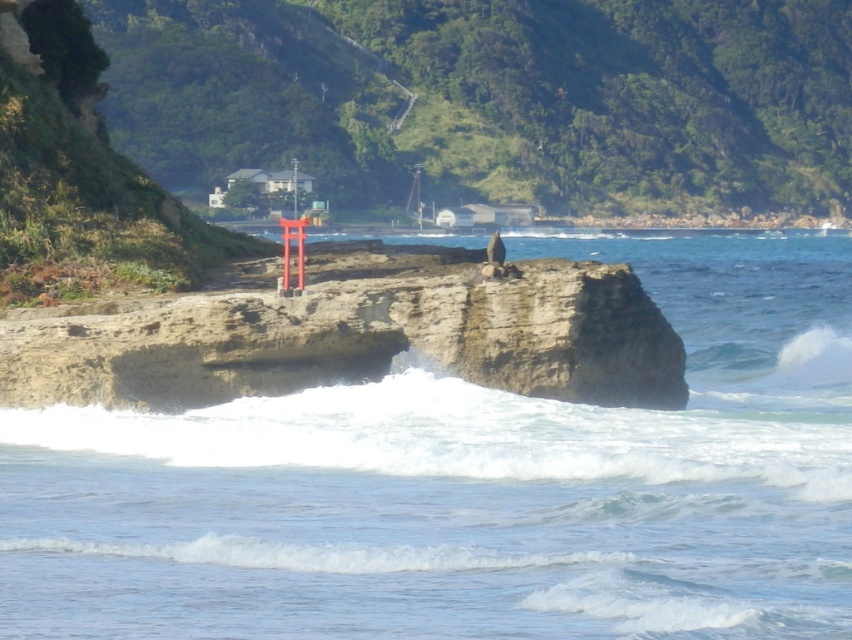
Question: Does clear blue water at center have a greater width compared to rusty stone cliff at center?

Choices:
 (A) yes
 (B) no

Answer: (A)

Question: Among these objects, which one is nearest to the camera?

Choices:
 (A) rusty stone cliff at center
 (B) clear blue water at center

Answer: (B)

Question: Is clear blue water at center to the right of rusty stone cliff at center from the viewer's perspective?

Choices:
 (A) yes
 (B) no

Answer: (A)

Question: Can you confirm if clear blue water at center is bigger than rusty stone cliff at center?

Choices:
 (A) no
 (B) yes

Answer: (B)

Question: Which of the following is the farthest from the observer?

Choices:
 (A) clear blue water at center
 (B) rusty stone cliff at center

Answer: (B)

Question: Which object is closer to the camera taking this photo?

Choices:
 (A) rusty stone cliff at center
 (B) clear blue water at center

Answer: (B)